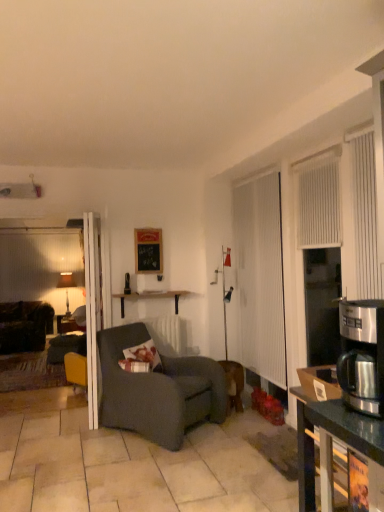
Question: In terms of size, does stainless steel coffee maker at right appear bigger or smaller than white wood shelf at center?

Choices:
 (A) small
 (B) big

Answer: (A)

Question: From a real-world perspective, is stainless steel coffee maker at right positioned above or below white wood shelf at center?

Choices:
 (A) below
 (B) above

Answer: (B)

Question: Estimate the real-world distances between objects in this image. Which object is closer to the matte black lampshade at left?

Choices:
 (A) white vertical blinds at right
 (B) black matte picture frame at center
 (C) white vertical blinds at right
 (D) dark gray fabric chair at center
 (E) white wood shelf at center

Answer: (E)

Question: Which object is positioned farthest from the white wood shelf at center?

Choices:
 (A) white vertical blinds at right
 (B) dark brown fabric couch at left
 (C) white textured screen door at right
 (D) black matte picture frame at center
 (E) matte black lampshade at left

Answer: (A)